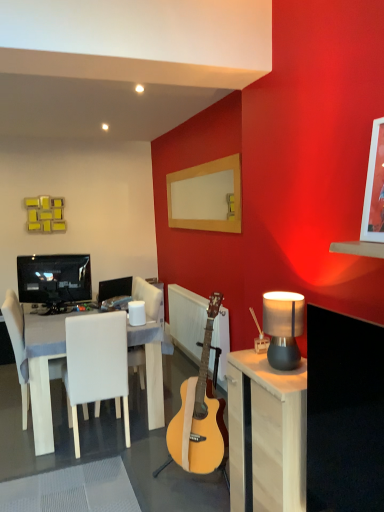
Question: Does matte black monitor at center, which is the 2th television in front-to-back order, have a greater height compared to wooden picture frame at upper right?

Choices:
 (A) no
 (B) yes

Answer: (A)

Question: From the image's perspective, does matte black monitor at center, the second television positioned from the left, appear higher than wooden picture frame at upper right?

Choices:
 (A) yes
 (B) no

Answer: (B)

Question: From a real-world perspective, does matte black monitor at center, which appears as the first television when viewed from the right, stand above wooden picture frame at upper right?

Choices:
 (A) no
 (B) yes

Answer: (A)

Question: Does matte black monitor at center, which appears as the first television when viewed from the right, come in front of wooden picture frame at upper right?

Choices:
 (A) yes
 (B) no

Answer: (B)

Question: Is matte black monitor at center, the second television positioned from the left, shorter than wooden picture frame at upper right?

Choices:
 (A) yes
 (B) no

Answer: (A)

Question: Considering the relative sizes of matte black monitor at center, the second television positioned from the left, and wooden picture frame at upper right in the image provided, is matte black monitor at center, the second television positioned from the left, wider than wooden picture frame at upper right?

Choices:
 (A) yes
 (B) no

Answer: (A)

Question: Can you confirm if white fabric chair at left, acting as the first chair starting from the left, is taller than wooden picture frame at upper right?

Choices:
 (A) no
 (B) yes

Answer: (B)

Question: Does white fabric chair at left, acting as the first chair starting from the left, have a larger size compared to wooden picture frame at upper right?

Choices:
 (A) no
 (B) yes

Answer: (B)

Question: Considering the relative sizes of white fabric chair at left, the 2th chair from the right, and wooden picture frame at upper right in the image provided, is white fabric chair at left, the 2th chair from the right, wider than wooden picture frame at upper right?

Choices:
 (A) no
 (B) yes

Answer: (B)

Question: Is white fabric chair at left, the 2th chair from the right, with wooden picture frame at upper right?

Choices:
 (A) no
 (B) yes

Answer: (A)

Question: Is wooden picture frame at upper right located within white fabric chair at left, acting as the first chair starting from the left?

Choices:
 (A) no
 (B) yes

Answer: (A)

Question: Considering the relative sizes of white fabric chair at left, the 2th chair from the right, and wooden picture frame at upper right in the image provided, is white fabric chair at left, the 2th chair from the right, thinner than wooden picture frame at upper right?

Choices:
 (A) no
 (B) yes

Answer: (A)

Question: Is white wood table at left smaller than wooden picture frame at upper right?

Choices:
 (A) no
 (B) yes

Answer: (A)